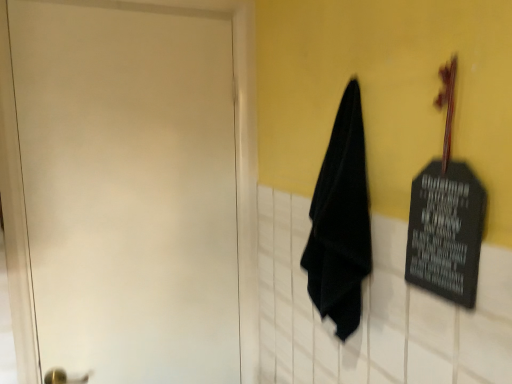
Question: Is black matte towel at center positioned beyond the bounds of white matte door at left?

Choices:
 (A) yes
 (B) no

Answer: (A)

Question: Can white matte door at left be found inside black matte towel at center?

Choices:
 (A) no
 (B) yes

Answer: (A)

Question: From a real-world perspective, does black matte towel at center sit lower than white matte door at left?

Choices:
 (A) no
 (B) yes

Answer: (A)

Question: Is black matte towel at center smaller than white matte door at left?

Choices:
 (A) yes
 (B) no

Answer: (A)

Question: Does black matte towel at center lie in front of white matte door at left?

Choices:
 (A) yes
 (B) no

Answer: (A)

Question: Does black matte towel at center appear on the right side of white matte door at left?

Choices:
 (A) no
 (B) yes

Answer: (B)

Question: Is black matte towel at center surrounded by white matte door at left?

Choices:
 (A) yes
 (B) no

Answer: (B)

Question: Can you confirm if white matte door at left is shorter than black matte towel at center?

Choices:
 (A) no
 (B) yes

Answer: (A)

Question: Is white matte door at left not near black matte towel at center?

Choices:
 (A) no
 (B) yes

Answer: (A)

Question: Can you confirm if white matte door at left is taller than black matte towel at center?

Choices:
 (A) yes
 (B) no

Answer: (A)

Question: Is white matte door at left thinner than black matte towel at center?

Choices:
 (A) yes
 (B) no

Answer: (A)

Question: Is white matte door at left facing away from black matte towel at center?

Choices:
 (A) no
 (B) yes

Answer: (A)

Question: From the image's perspective, relative to black matte towel at center, is white matte door at left above or below?

Choices:
 (A) above
 (B) below

Answer: (B)